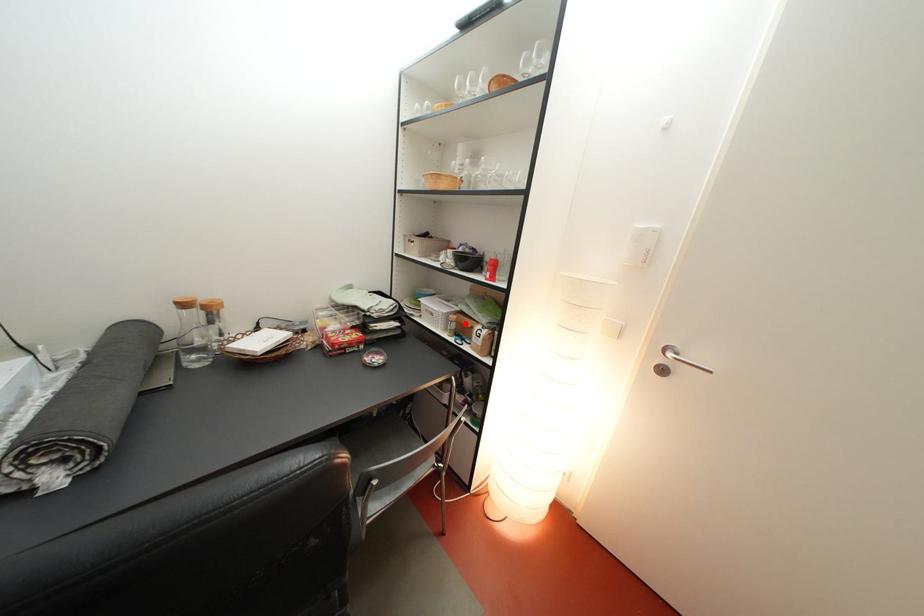
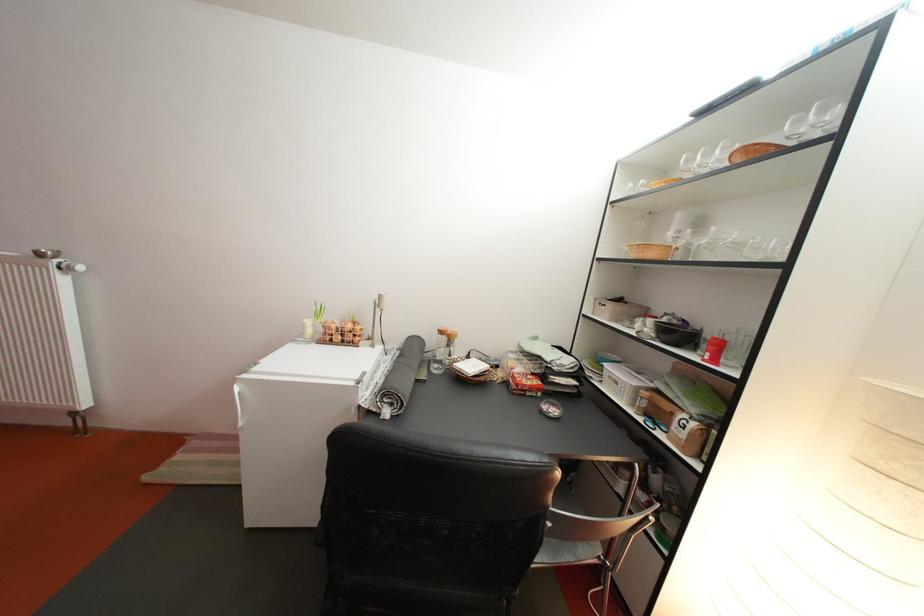
The point at the highlighted location is marked in the first image. Where is the corresponding point in the second image?

(658, 400)